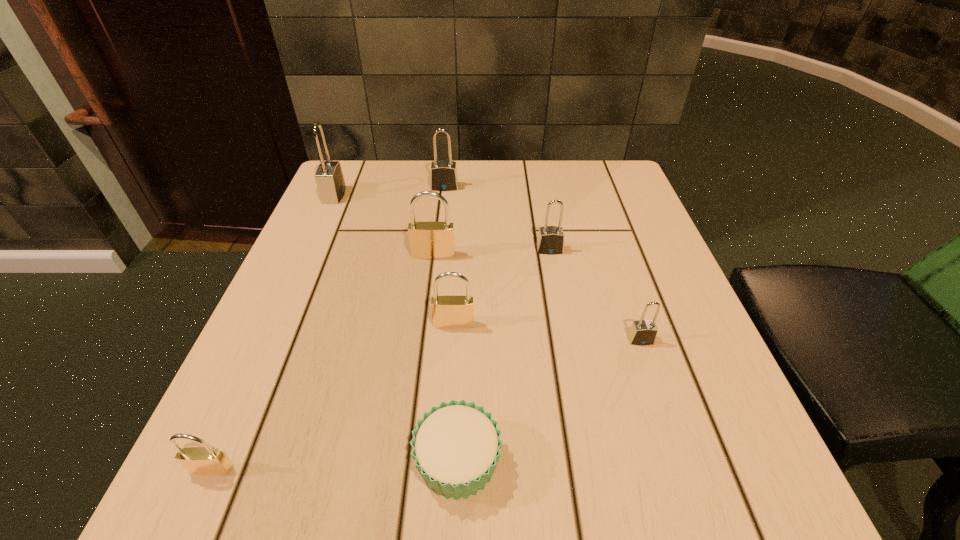
Identify the location of the leftmost gray padlock. This screenshot has height=540, width=960. (329, 177).

Identify the location of the tallest object. The height and width of the screenshot is (540, 960). (329, 177).

You are a GUI agent. You are given a task and a screenshot of the screen. Output one action in this format:
    pyautogui.click(x=<x>, y=<y>)
    Task: Click on the third gray padlock from right to left
    The height and width of the screenshot is (540, 960).
    Given the screenshot: What is the action you would take?
    pyautogui.click(x=444, y=177)

Find the location of `the farthest brass padlock`. the farthest brass padlock is located at coordinates (428, 240).

The height and width of the screenshot is (540, 960). In order to click on the third gray padlock from left to right in this screenshot , I will do `click(550, 241)`.

Find the location of a particular element. The width and height of the screenshot is (960, 540). the sixth padlock from left to right is located at coordinates (550, 241).

I want to click on the fifth farthest padlock, so click(448, 312).

Where is `the fourth nearest object`? the fourth nearest object is located at coordinates (448, 312).

The height and width of the screenshot is (540, 960). I want to click on the third nearest object, so click(642, 332).

The width and height of the screenshot is (960, 540). What are the coordinates of `the rightmost padlock` in the screenshot? It's located at (642, 332).